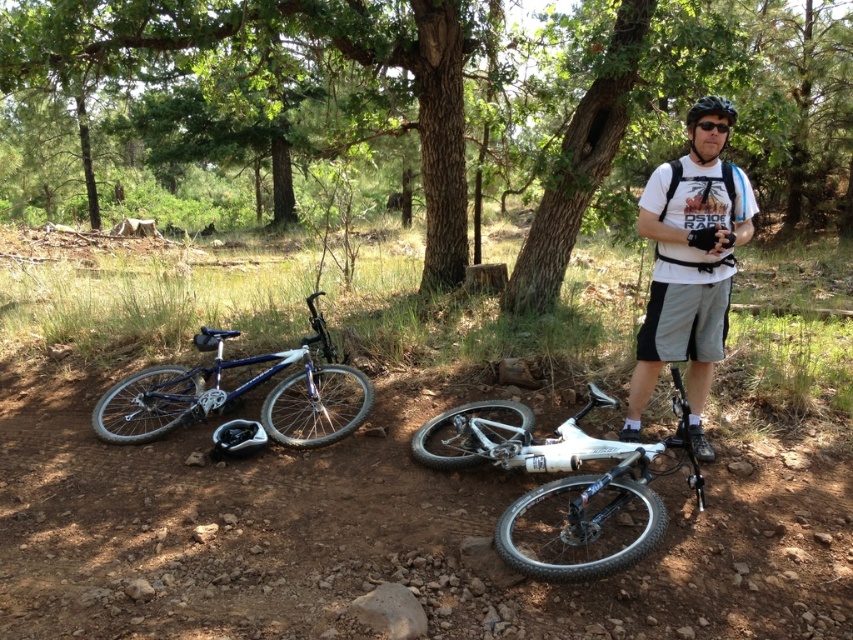
You are standing in a forested area with rugged terrain. You see a white matte bicycle at lower center. Can you reach the bicycle within 5 feet without moving your feet?

The white matte bicycle at lower center is 10.00 feet away from you, so you cannot reach it within 5 feet without moving your feet.